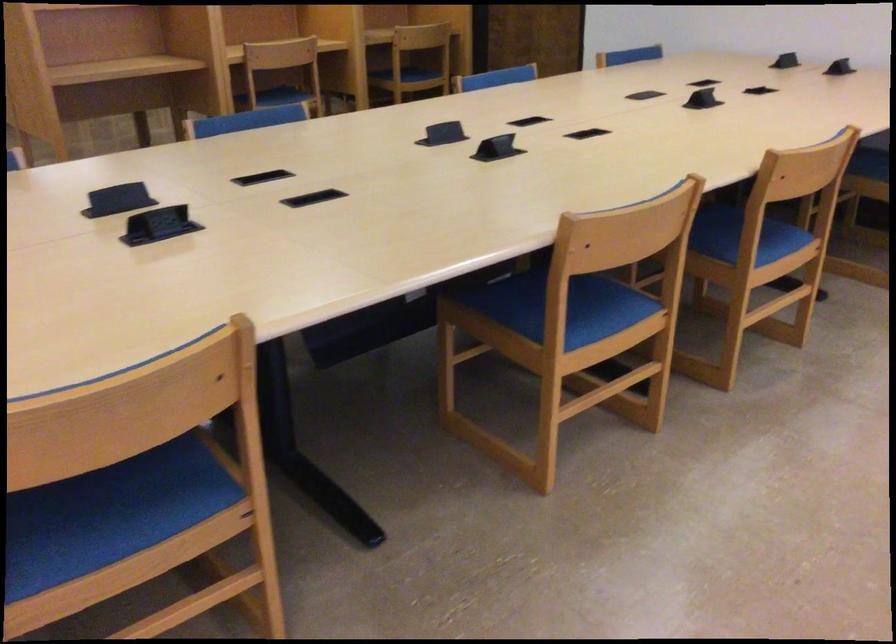
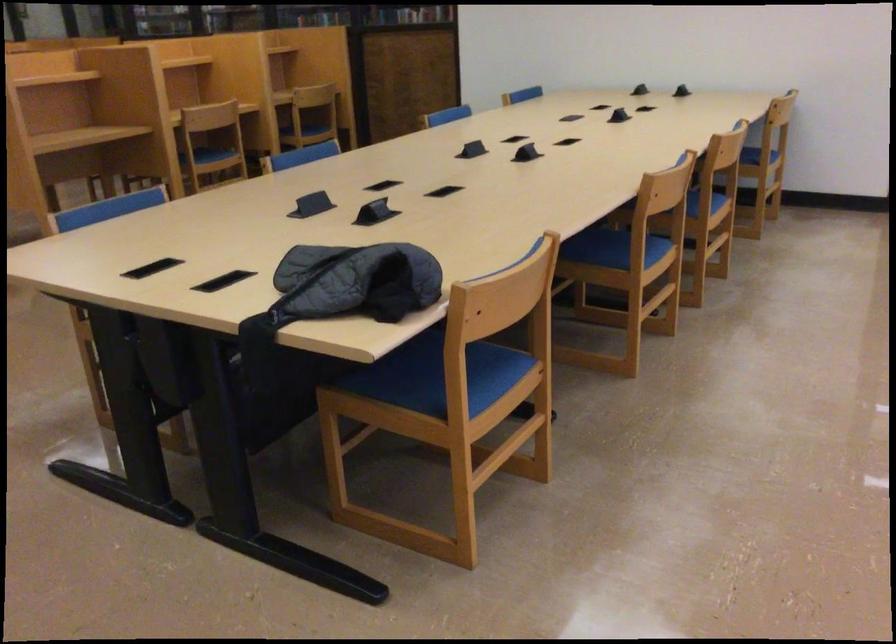
Which direction would the cameraman need to move to produce the second image?

The cameraman walked toward left, backward.